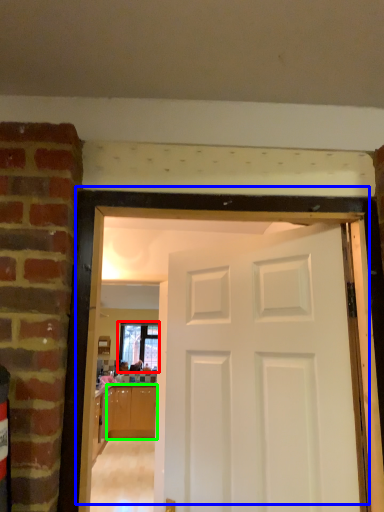
Question: Considering the real-world distances, which object is farthest from window (highlighted by a red box)? door (highlighted by a blue box) or cabinetry (highlighted by a green box)?

Choices:
 (A) door
 (B) cabinetry

Answer: (A)